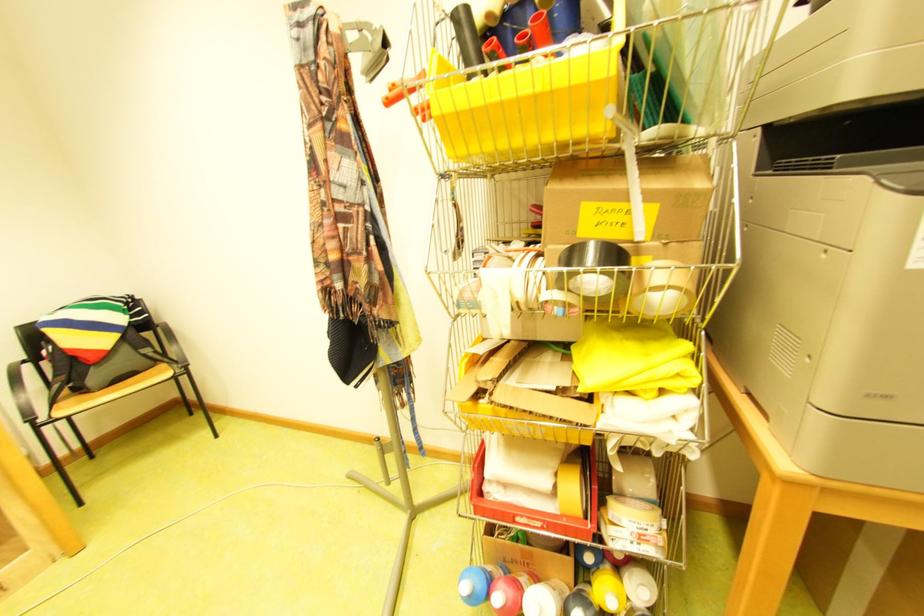
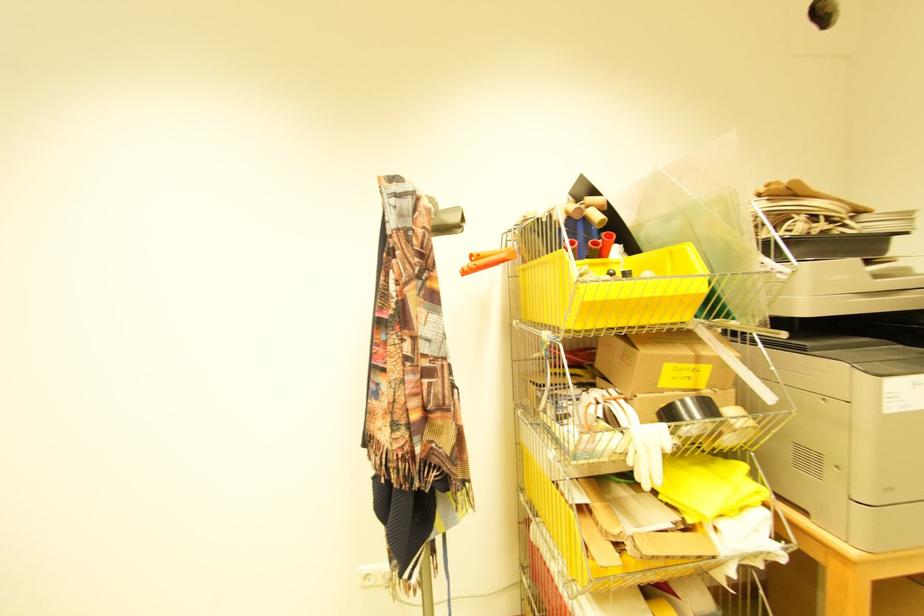
The point at [407,86] is marked in the first image. Where is the corresponding point in the second image?

(492, 254)